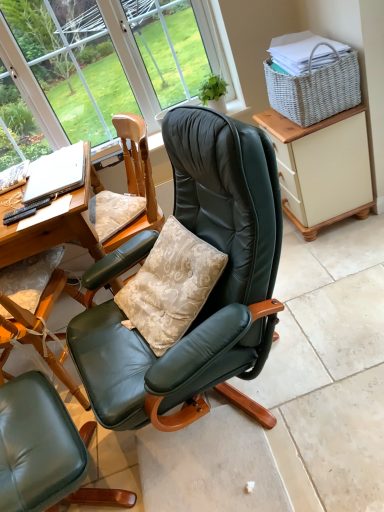
Question: Is matte green leather chair at center looking in the opposite direction of black plastic remote control at lower left?

Choices:
 (A) no
 (B) yes

Answer: (A)

Question: Is matte green leather chair at center outside of black plastic remote control at lower left?

Choices:
 (A) no
 (B) yes

Answer: (B)

Question: Is matte green leather chair at center at the left side of black plastic remote control at lower left?

Choices:
 (A) yes
 (B) no

Answer: (B)

Question: Can black plastic remote control at lower left be found inside matte green leather chair at center?

Choices:
 (A) yes
 (B) no

Answer: (B)

Question: From the image's perspective, is matte green leather chair at center below black plastic remote control at lower left?

Choices:
 (A) yes
 (B) no

Answer: (A)

Question: Considering the relative sizes of matte green leather chair at center and black plastic remote control at lower left in the image provided, is matte green leather chair at center taller than black plastic remote control at lower left?

Choices:
 (A) yes
 (B) no

Answer: (A)

Question: Does matte green leather chair at center come behind beige painted cabinet at right?

Choices:
 (A) yes
 (B) no

Answer: (B)

Question: Can you confirm if matte green leather chair at center is wider than beige painted cabinet at right?

Choices:
 (A) yes
 (B) no

Answer: (A)

Question: From the image's perspective, is matte green leather chair at center beneath beige painted cabinet at right?

Choices:
 (A) yes
 (B) no

Answer: (A)

Question: Is the surface of matte green leather chair at center in direct contact with beige painted cabinet at right?

Choices:
 (A) yes
 (B) no

Answer: (B)

Question: Can you confirm if matte green leather chair at center is bigger than beige painted cabinet at right?

Choices:
 (A) yes
 (B) no

Answer: (A)

Question: Would you say matte green leather chair at center is outside beige painted cabinet at right?

Choices:
 (A) no
 (B) yes

Answer: (B)

Question: Does silver metallic laptop at left turn towards black plastic remote control at lower left?

Choices:
 (A) yes
 (B) no

Answer: (A)